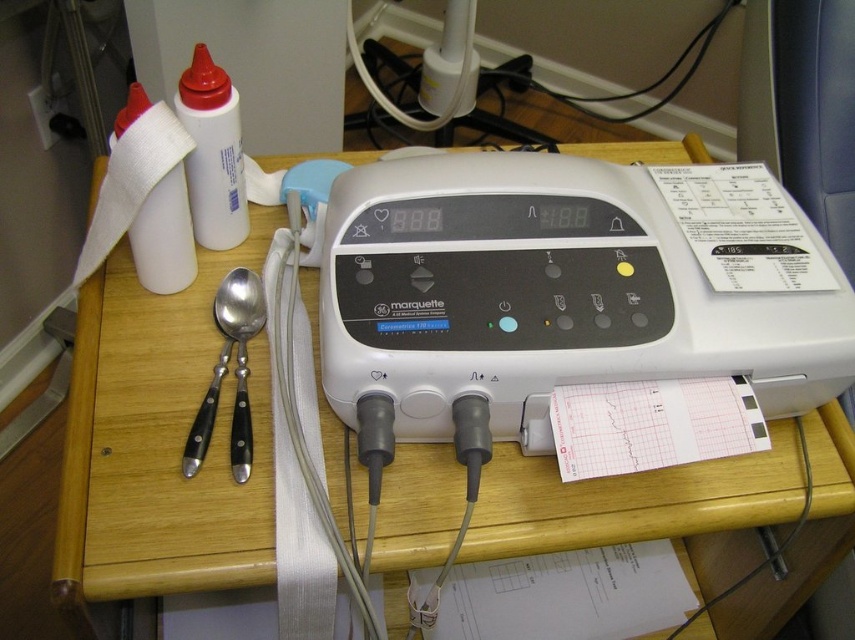
This screenshot has height=640, width=855. What do you see at coordinates (158, 444) in the screenshot?
I see `wooden table at center` at bounding box center [158, 444].

Between point (136, 525) and point (43, 116), which one is positioned behind?

The point (43, 116) is behind.

Between point (144, 461) and point (30, 99), which one is positioned in front?

Point (144, 461)

I want to click on wooden table at center, so click(x=158, y=444).

Between wooden table at center and white matte bottle at upper left, which one is positioned higher?

white matte bottle at upper left

Is wooden table at center above white matte bottle at upper left?

No, wooden table at center is not above white matte bottle at upper left.

Where is `wooden table at center`? This screenshot has height=640, width=855. wooden table at center is located at coordinates (158, 444).

Does white plastic bottle at upper left appear over white matte bottle at upper left?

Correct, white plastic bottle at upper left is located above white matte bottle at upper left.

Who is more distant from viewer, (193, 144) or (149, 195)?

Positioned behind is point (193, 144).

Consider the image. Who is more distant from viewer, (205,209) or (149,227)?

Positioned behind is point (205,209).

The image size is (855, 640). In order to click on white plastic bottle at upper left in this screenshot , I will do `click(211, 152)`.